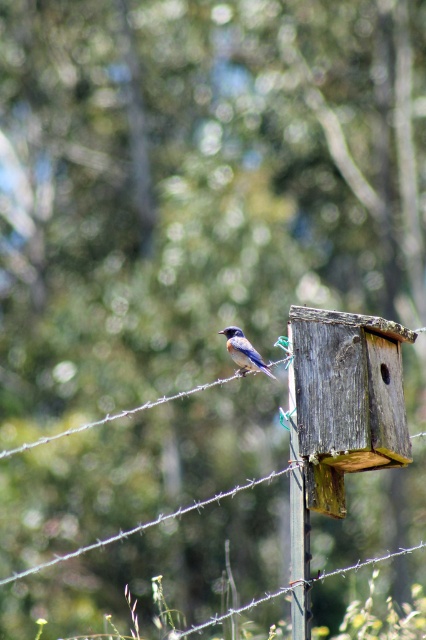
You are a photographer trying to capture the wooden post at center and the blue glossy bird at center in a single frame. Based on their sizes, which object would appear larger in the photo?

The wooden post at center is taller than the blue glossy bird at center, so it would appear larger in the photo.

Based on the photo, you are a photographer aiming to capture the wooden post at center and the blue glossy bird at center in a single shot. Since you want the bird to be in focus, which object should you adjust your camera focus on first?

The wooden post at center is closer to the viewer than the blue glossy bird at center, so you should focus on the wooden post at center first to ensure it is sharp before adjusting for the bird.